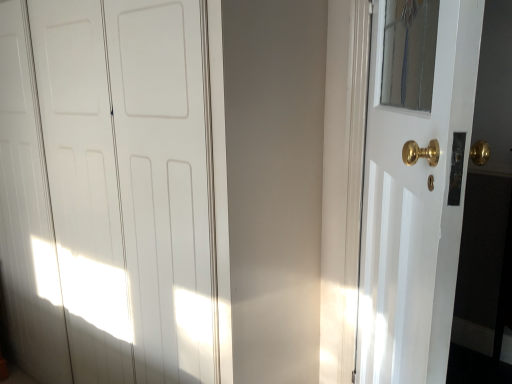
Question: Is point (361, 228) closer or farther from the camera than point (29, 183)?

Choices:
 (A) farther
 (B) closer

Answer: (B)

Question: From a real-world perspective, relative to white glossy door at center, which is the second door from right to left, is white glossy door at right, which appears as the 1th door when viewed from the right, vertically above or below?

Choices:
 (A) above
 (B) below

Answer: (A)

Question: From their relative heights in the image, would you say white glossy door at right, which appears as the 1th door when viewed from the right, is taller or shorter than white glossy door at center, which appears as the 1th door when viewed from the left?

Choices:
 (A) tall
 (B) short

Answer: (B)

Question: Based on their sizes in the image, would you say white glossy door at center, which appears as the 1th door when viewed from the left, is bigger or smaller than white glossy door at right, which appears as the 1th door when viewed from the right?

Choices:
 (A) small
 (B) big

Answer: (B)

Question: From the image's perspective, is white glossy door at center, which is the second door from right to left, positioned above or below white glossy door at right, which appears as the second door when viewed from the left?

Choices:
 (A) above
 (B) below

Answer: (A)

Question: In terms of height, does white glossy door at center, which is the second door from right to left, look taller or shorter compared to white glossy door at right, which appears as the 1th door when viewed from the right?

Choices:
 (A) tall
 (B) short

Answer: (A)

Question: From a real-world perspective, is white glossy door at center, which is the second door from right to left, above or below white glossy door at right, which appears as the second door when viewed from the left?

Choices:
 (A) above
 (B) below

Answer: (B)